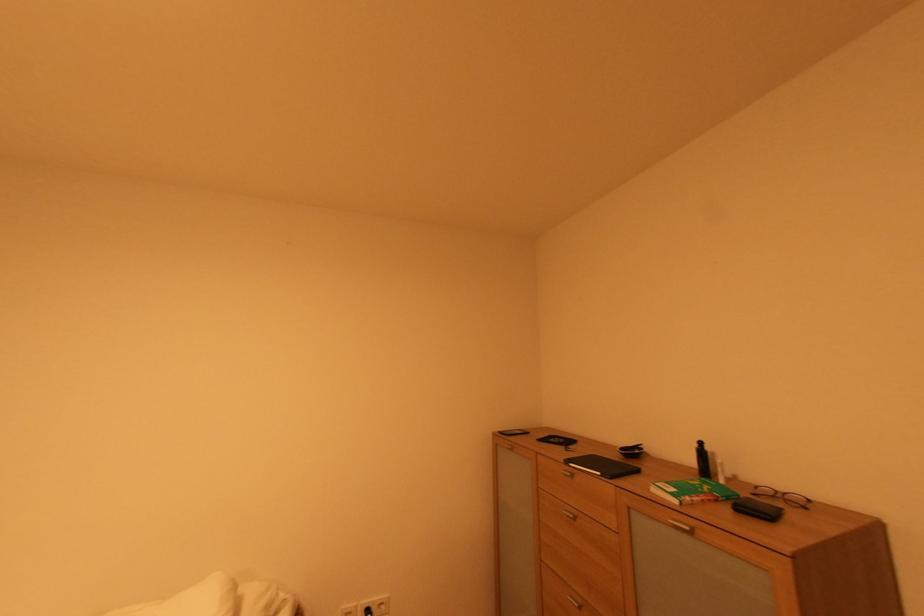
The image size is (924, 616). Find the location of `metal cabinet handle`. metal cabinet handle is located at coordinates (679, 525).